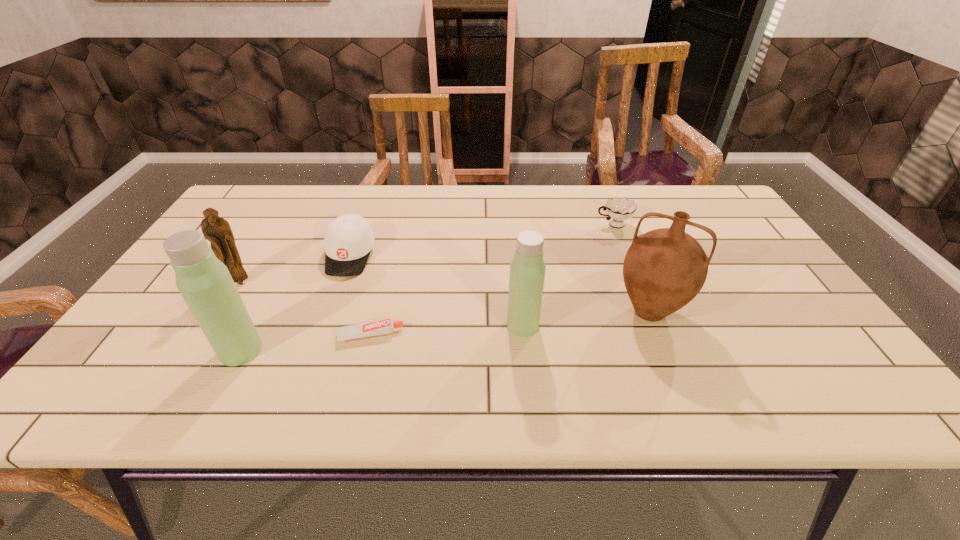
Where is `pitcher that is at the near edge`? This screenshot has height=540, width=960. pitcher that is at the near edge is located at coordinates (664, 269).

The width and height of the screenshot is (960, 540). What are the coordinates of `toothpaste that is at the near edge` in the screenshot? It's located at (386, 326).

You are a GUI agent. You are given a task and a screenshot of the screen. Output one action in this format:
    pyautogui.click(x=<x>, y=<y>)
    Task: Click on the object at the left edge
    
    Given the screenshot: What is the action you would take?
    pyautogui.click(x=217, y=230)

This screenshot has width=960, height=540. What are the coordinates of `vacant space at the far edge` in the screenshot? It's located at (425, 212).

This screenshot has height=540, width=960. I want to click on free spot at the near edge of the desktop, so 320,345.

In the image, there is a desktop. Where is `vacant space at the far left corner`? The image size is (960, 540). vacant space at the far left corner is located at coordinates (275, 192).

The height and width of the screenshot is (540, 960). In order to click on vacant space at the far right corner of the desktop in this screenshot , I will do `click(725, 221)`.

This screenshot has width=960, height=540. In the image, there is a desktop. What are the coordinates of `free space at the near right corner` in the screenshot? It's located at (802, 355).

In order to click on empty space between the right thermos bottle and the pitcher in this screenshot , I will do `click(586, 319)`.

Identify the location of unoccupied position between the taller thermos bottle and the toothpaste. point(305,343).